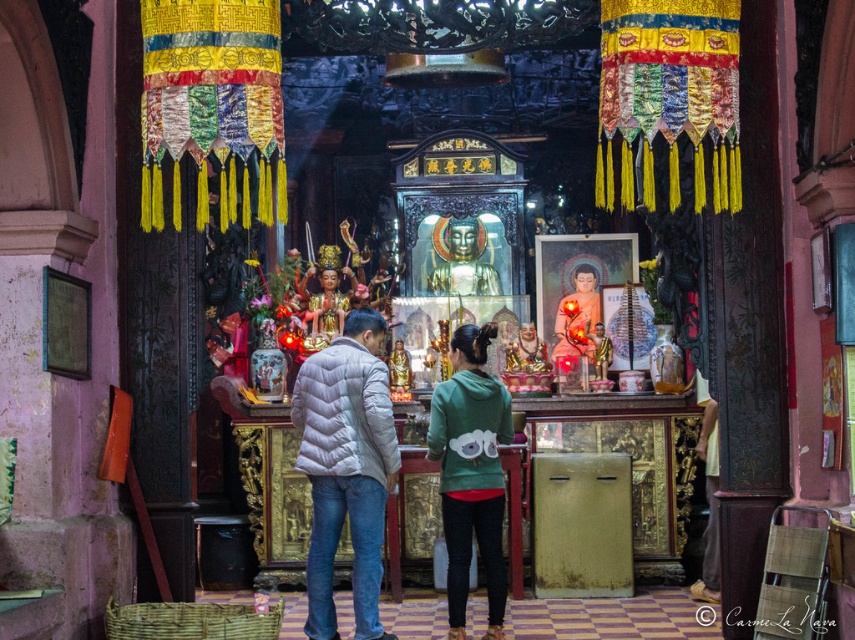
Question: Among these points, which one is nearest to the camera?

Choices:
 (A) (578, 320)
 (B) (470, 369)

Answer: (B)

Question: From the image, what is the correct spatial relationship of white quilted jacket at center in relation to green fleece jacket at center?

Choices:
 (A) left
 (B) right

Answer: (A)

Question: Which of the following is the farthest from the observer?

Choices:
 (A) (317, 604)
 (B) (576, 342)
 (C) (444, 532)

Answer: (B)

Question: Considering the real-world distances, which object is closest to the white quilted jacket at center?

Choices:
 (A) green fleece jacket at center
 (B) matte green hoodie at center

Answer: (A)

Question: Is green fleece jacket at center smaller than matte green hoodie at center?

Choices:
 (A) no
 (B) yes

Answer: (A)

Question: Is green fleece jacket at center thinner than matte green hoodie at center?

Choices:
 (A) no
 (B) yes

Answer: (A)